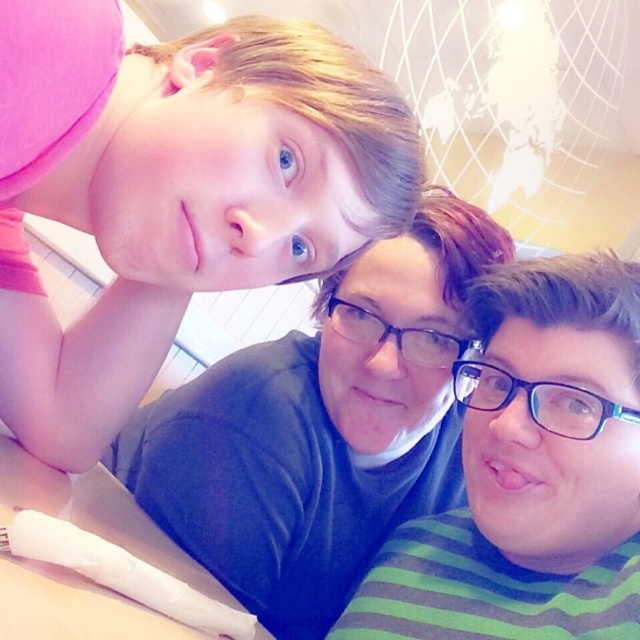
You are a photographer trying to capture a clear shot of the transparent plastic glasses at center. However, the white plastic table at lower left is blocking your view. Can you move the table to the side to get a better angle?

The white plastic table at lower left is in front of the transparent plastic glasses at center, so moving the table would allow you to see the glasses more clearly.

You are trying to locate the matte black shirt at center in the image. According to the coordinates provided, where would you find it?

The matte black shirt at center is located at point coordinates of 0.669 on the x axis and 0.502 on the y axis.